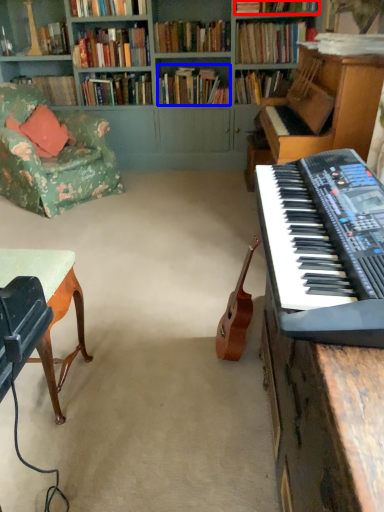
Question: Which object is closer to the camera taking this photo, book (highlighted by a red box) or book (highlighted by a blue box)?

Choices:
 (A) book
 (B) book

Answer: (A)